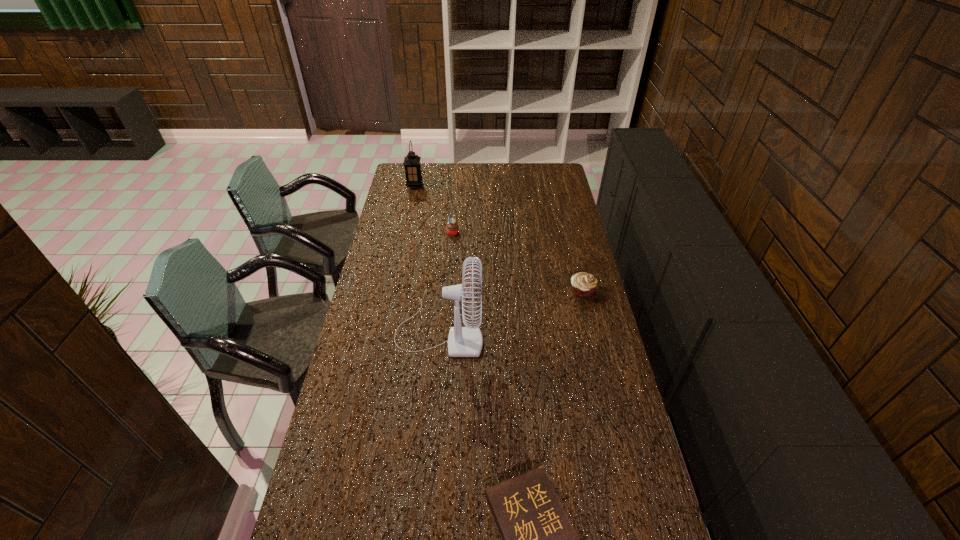
Image resolution: width=960 pixels, height=540 pixels. I want to click on free region that satisfies the following two spatial constraints: 1. on the front-facing side of the nearer muffin; 2. on the left side of the fourth nearest object, so click(x=448, y=291).

Locate an element on the screen. This screenshot has height=540, width=960. vacant space that satisfies the following two spatial constraints: 1. on the front side of the fourth shortest object; 2. on the right side of the nearer muffin is located at coordinates (394, 291).

Where is `free space that satisfies the following two spatial constraints: 1. on the front-facing side of the farther muffin; 2. on the right side of the nearer muffin`? The image size is (960, 540). free space that satisfies the following two spatial constraints: 1. on the front-facing side of the farther muffin; 2. on the right side of the nearer muffin is located at coordinates (448, 291).